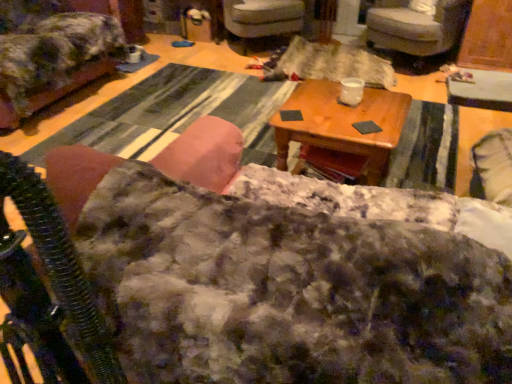
Question: Should I look upward or downward to see velvet gray armchair at center, positioned as the second chair in left-to-right order?

Choices:
 (A) up
 (B) down

Answer: (A)

Question: Should I look upward or downward to see velvet gray armchair at upper right, which is the 1th chair from right to left?

Choices:
 (A) down
 (B) up

Answer: (B)

Question: From a real-world perspective, is fuzzy fabric rocking chair at left over fluffy fabric chair at upper left, placed as the 1th chair when sorted from left to right?

Choices:
 (A) no
 (B) yes

Answer: (B)

Question: Does fuzzy fabric rocking chair at left have a greater height compared to fluffy fabric chair at upper left, which ranks as the third chair in right-to-left order?

Choices:
 (A) no
 (B) yes

Answer: (B)

Question: Can we say fuzzy fabric rocking chair at left lies outside fluffy fabric chair at upper left, which ranks as the third chair in right-to-left order?

Choices:
 (A) no
 (B) yes

Answer: (B)

Question: Is fuzzy fabric rocking chair at left at the left side of fluffy fabric chair at upper left, which ranks as the third chair in right-to-left order?

Choices:
 (A) no
 (B) yes

Answer: (A)

Question: Is fuzzy fabric rocking chair at left placed right next to fluffy fabric chair at upper left, which ranks as the third chair in right-to-left order?

Choices:
 (A) yes
 (B) no

Answer: (B)

Question: From a real-world perspective, does fuzzy fabric rocking chair at left sit lower than fluffy fabric chair at upper left, which ranks as the third chair in right-to-left order?

Choices:
 (A) no
 (B) yes

Answer: (A)

Question: Is fluffy fabric couch at center bigger than wooden table at center?

Choices:
 (A) no
 (B) yes

Answer: (B)

Question: From a real-world perspective, is fluffy fabric couch at center located higher than wooden table at center?

Choices:
 (A) no
 (B) yes

Answer: (B)

Question: Can you confirm if fluffy fabric couch at center is wider than wooden table at center?

Choices:
 (A) no
 (B) yes

Answer: (B)

Question: Is fluffy fabric couch at center smaller than wooden table at center?

Choices:
 (A) no
 (B) yes

Answer: (A)

Question: Is fluffy fabric couch at center not inside wooden table at center?

Choices:
 (A) yes
 (B) no

Answer: (A)

Question: From a real-world perspective, is fluffy fabric couch at center beneath wooden table at center?

Choices:
 (A) yes
 (B) no

Answer: (B)

Question: Can you confirm if velvet gray armchair at upper right, which is the 1th chair from right to left, is taller than velvet gray armchair at center, positioned as the second chair in left-to-right order?

Choices:
 (A) no
 (B) yes

Answer: (B)